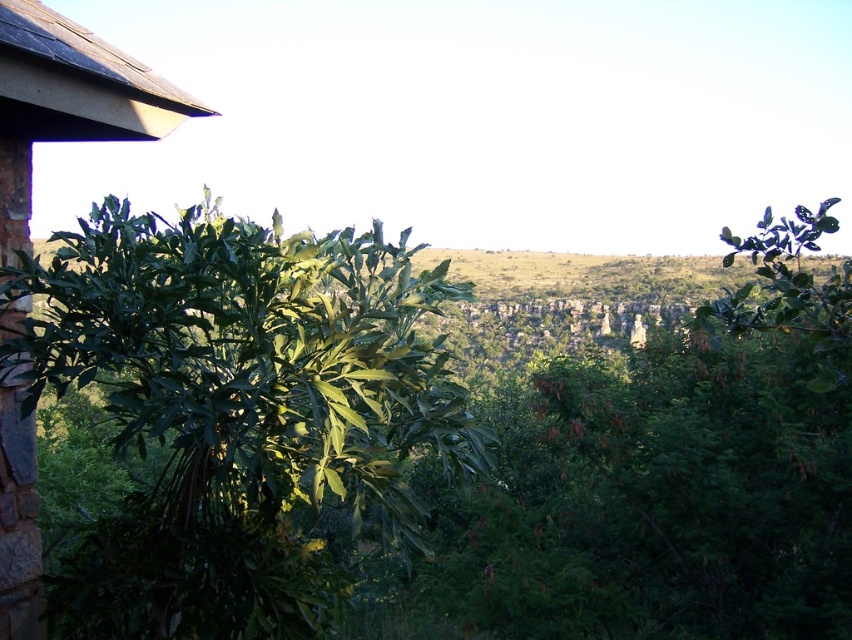
Question: Which point is farther from the camera taking this photo?

Choices:
 (A) (88, 65)
 (B) (459, 403)

Answer: (B)

Question: Can you confirm if green leafy plant at center is bigger than brown stone hut at left?

Choices:
 (A) no
 (B) yes

Answer: (B)

Question: Can you confirm if green leafy plant at center is wider than brown stone hut at left?

Choices:
 (A) no
 (B) yes

Answer: (B)

Question: Is green leafy plant at center positioned at the back of brown stone hut at left?

Choices:
 (A) yes
 (B) no

Answer: (A)